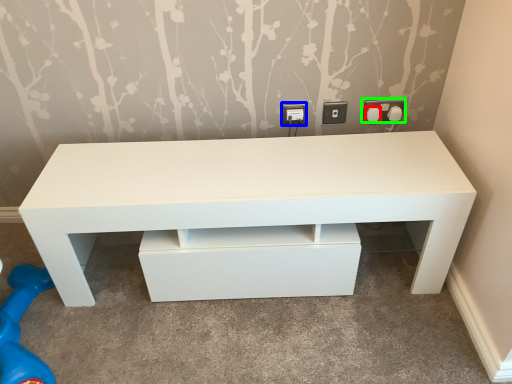
Question: Based on their relative distances, which object is nearer to knob (highlighted by a red box)? Choose from electric outlet (highlighted by a blue box) and electric outlet (highlighted by a green box).

Choices:
 (A) electric outlet
 (B) electric outlet

Answer: (B)